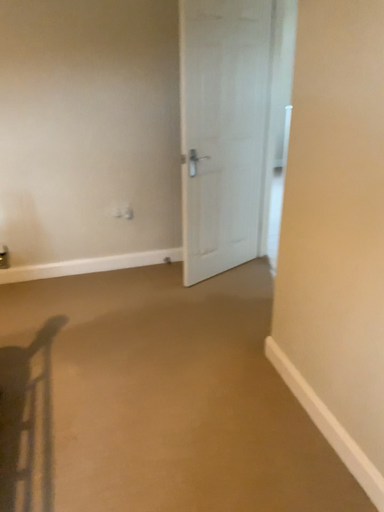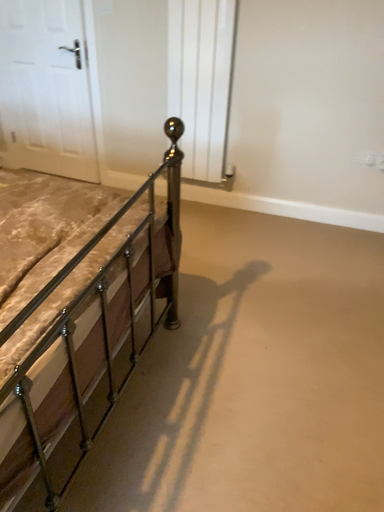
Question: Which way did the camera rotate in the video?

Choices:
 (A) rotated left
 (B) rotated right

Answer: (A)